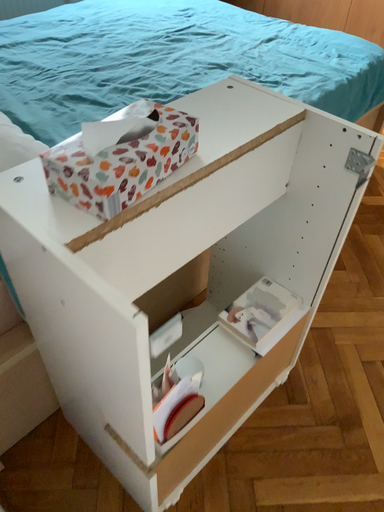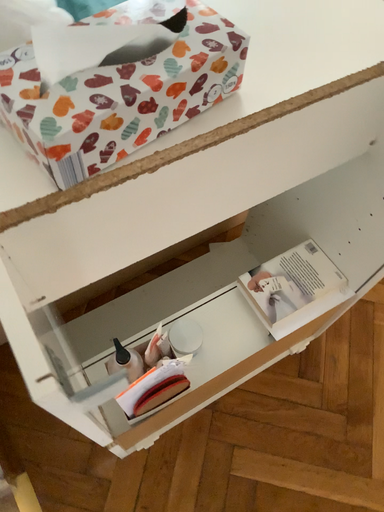
Question: How did the camera likely rotate when shooting the video?

Choices:
 (A) rotated right
 (B) rotated left

Answer: (B)